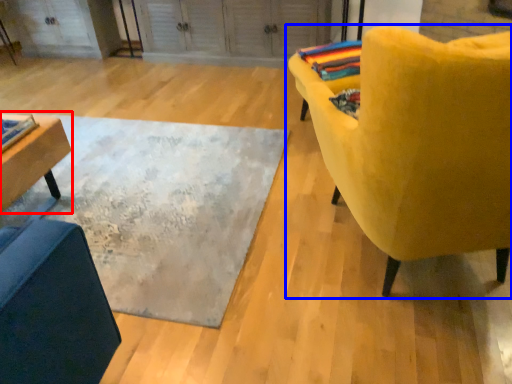
Question: Which object is closer to the camera taking this photo, table (highlighted by a red box) or chair (highlighted by a blue box)?

Choices:
 (A) table
 (B) chair

Answer: (B)